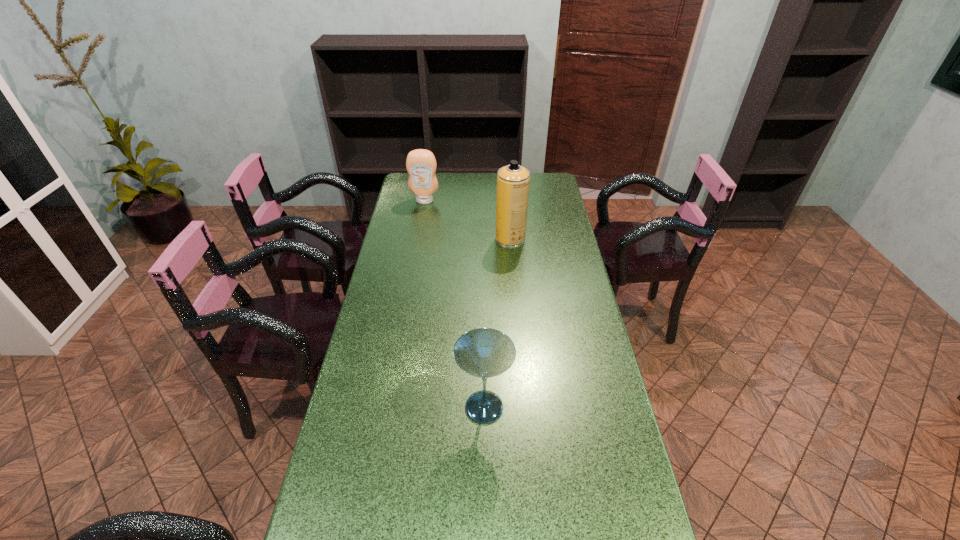
The height and width of the screenshot is (540, 960). Find the location of `object located in the far left corner section of the desktop`. object located in the far left corner section of the desktop is located at coordinates (421, 164).

The height and width of the screenshot is (540, 960). In order to click on vacant area at the far edge in this screenshot , I will do `click(482, 186)`.

Image resolution: width=960 pixels, height=540 pixels. Find the location of `vacant space at the left edge of the desktop`. vacant space at the left edge of the desktop is located at coordinates (392, 304).

Locate an element on the screen. The height and width of the screenshot is (540, 960). free location at the right edge is located at coordinates (557, 227).

You are a GUI agent. You are given a task and a screenshot of the screen. Output one action in this format:
    pyautogui.click(x=<x>, y=<y>)
    Task: Click on the empty space between the leftmost object and the aerosol can
    Image resolution: width=960 pixels, height=540 pixels.
    Given the screenshot: What is the action you would take?
    pyautogui.click(x=468, y=220)

The height and width of the screenshot is (540, 960). I want to click on blank region between the farthest object and the nearest object, so click(454, 304).

Find the location of a particular element. The width and height of the screenshot is (960, 540). free space between the leftmost object and the tallest object is located at coordinates (468, 220).

I want to click on free space between the leftmost object and the nearest object, so point(454,304).

This screenshot has width=960, height=540. Find the location of `empty location between the farthest object and the martini`. empty location between the farthest object and the martini is located at coordinates (454, 304).

The height and width of the screenshot is (540, 960). What are the coordinates of `object that is the closest one to the nearest object` in the screenshot? It's located at (513, 180).